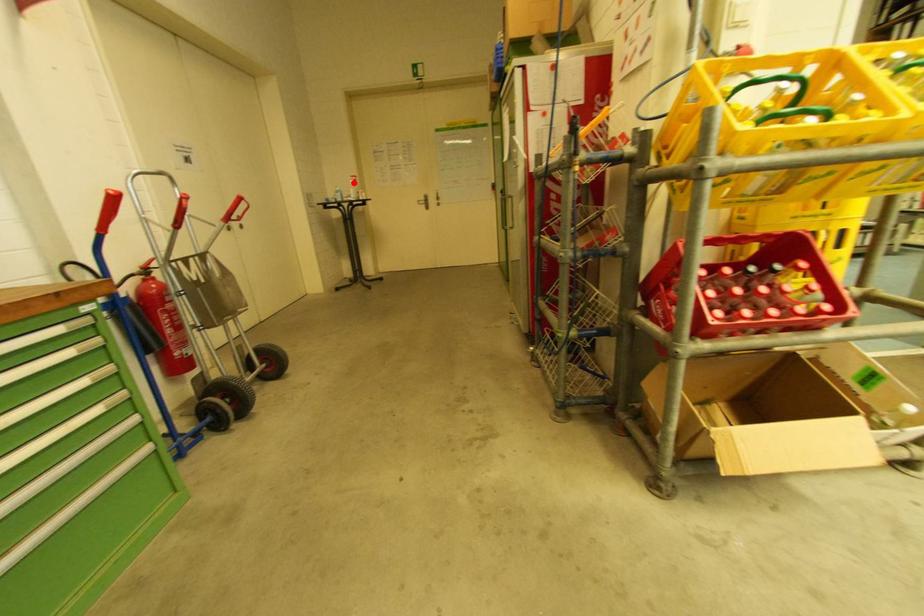
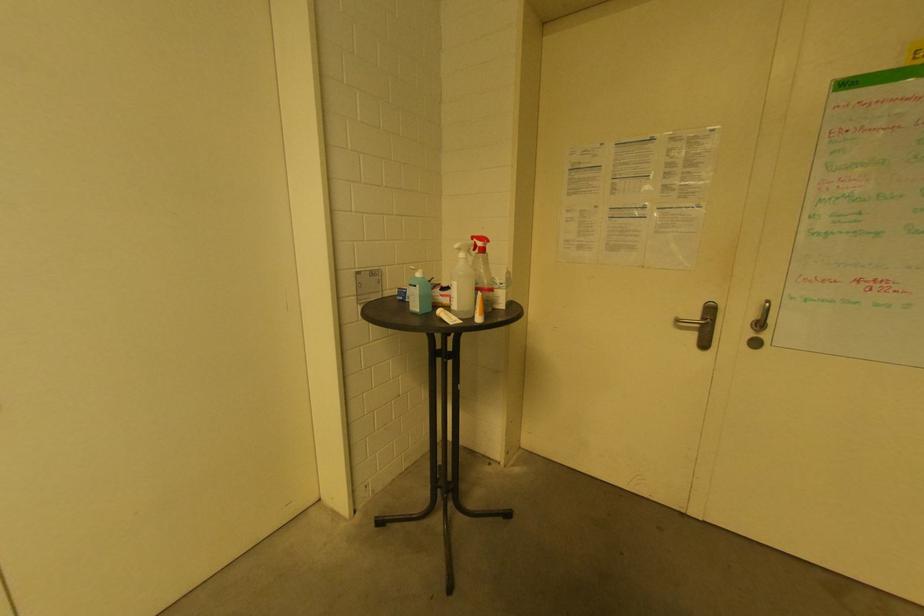
Question: A red point is marked in image1. In image2, is the corresponding 3D point closer to the camera or farther? Reply with the corresponding letter.

Choices:
 (A) The corresponding 3D point is closer.
 (B) The corresponding 3D point is farther.

Answer: (B)